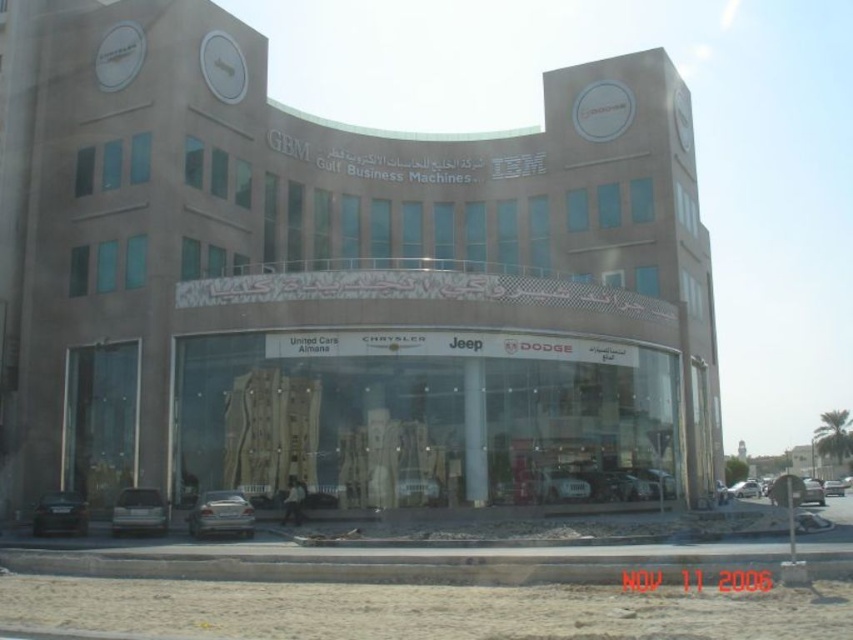
Can you confirm if satin silver sedan at lower center is wider than silver metallic sedan at lower left?

No.

Between satin silver sedan at lower center and silver metallic sedan at lower left, which one appears on the right side from the viewer's perspective?

satin silver sedan at lower center is more to the right.

Is point (247, 536) farther from viewer compared to point (136, 497)?

No.

In order to click on satin silver sedan at lower center in this screenshot , I will do `click(221, 515)`.

Is satin silver sedan at lower center above dark gray metallic sedan at lower left?

No.

Is satin silver sedan at lower center smaller than dark gray metallic sedan at lower left?

Yes.

Does point (206, 508) lie in front of point (61, 516)?

That is True.

Find the location of `satin silver sedan at lower center`. satin silver sedan at lower center is located at coordinates (221, 515).

Is silver metallic sedan at lower left to the right of dark gray metallic sedan at lower left from the viewer's perspective?

Yes, silver metallic sedan at lower left is to the right of dark gray metallic sedan at lower left.

Is silver metallic sedan at lower left above dark gray metallic sedan at lower left?

Correct, silver metallic sedan at lower left is located above dark gray metallic sedan at lower left.

Is point (120, 506) behind point (44, 497)?

No, it is in front of (44, 497).

Locate an element on the screen. Image resolution: width=853 pixels, height=640 pixels. silver metallic sedan at lower left is located at coordinates (138, 513).